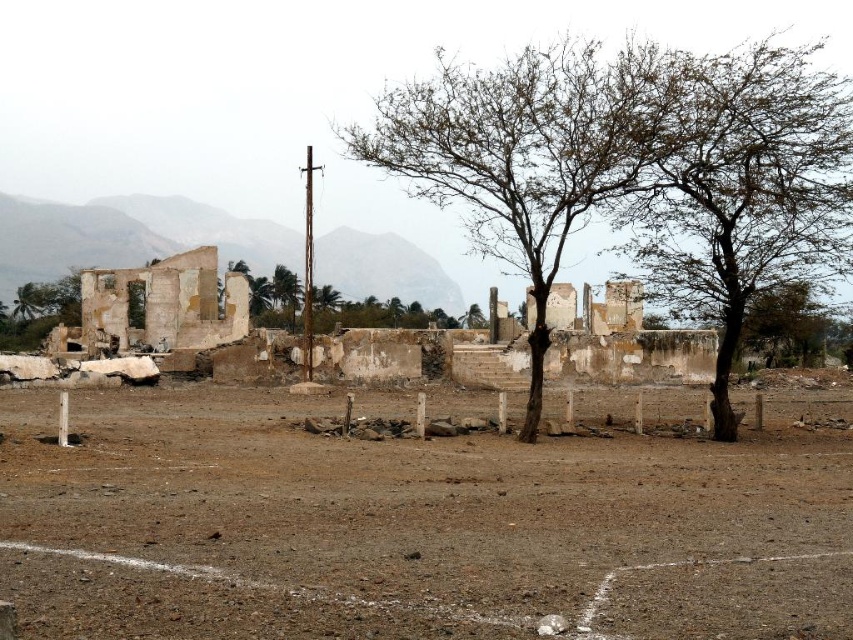
You are standing in the ruins of an old building and see the white concrete pillar at center and the green leafy tree at center. Which object is positioned lower in the scene?

The white concrete pillar at center is located below the green leafy tree at center, so it is positioned lower in the scene.

You are standing in the middle of the ruins and want to take a photo of both the white concrete pillar at center and the green leafy tree at center. Which object should you focus on first if you want both to be in frame without moving the camera?

The white concrete pillar at center is much taller than the green leafy tree at center, so you should focus on the white concrete pillar at center first to ensure it fits within the frame.

You are standing at the edge of the dirt ground in the scene. You want to climb the highest object to get a better view. Which object should you choose between the brown leafy tree at right and the weathered concrete ruins at center?

The brown leafy tree at right is much taller than the weathered concrete ruins at center, so you should climb the brown leafy tree at right to get a better view.